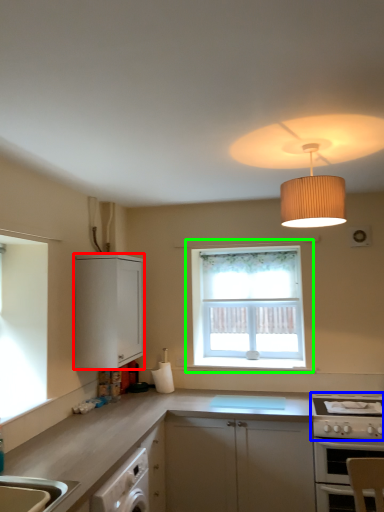
Question: Considering the real-world distances, which object is closest to cabinetry (highlighted by a red box)? gas stove (highlighted by a blue box) or window (highlighted by a green box).

Choices:
 (A) gas stove
 (B) window

Answer: (B)